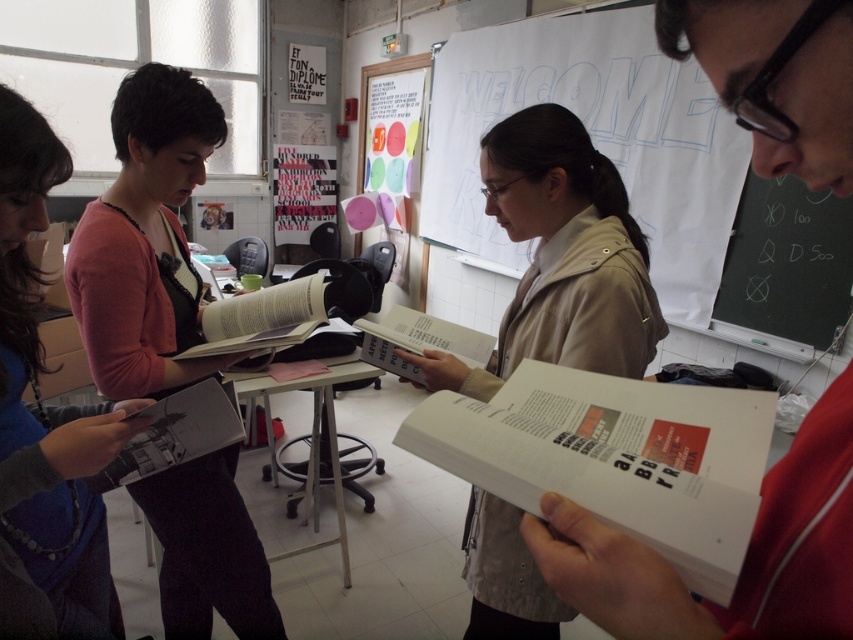
You are a participant in this collaborative activity and need to quickly reference a page in one of the books. Which object would be easier to flip through quickly, the white paper book at center or the beige fabric jacket at center?

The white paper book at center is thinner than the beige fabric jacket at center, so it would be easier to flip through quickly.

You are an attendee at this event and you want to see both the white paper at upper center and the beige fabric jacket at center. Which object do you need to move closer to first?

The beige fabric jacket at center is behind the white paper at upper center, so you need to move closer to the white paper at upper center first to see both objects.

You are standing in the classroom and need to reach the point labeled as point (x=107, y=358). There is an obstacle at point (x=608, y=125). Will you be able to walk directly to your destination without going around the obstacle?

Point (x=608, y=125) is behind point (x=107, y=358), so the obstacle at point (x=608, y=125) is not blocking your path to point (x=107, y=358). You can walk directly to your destination without going around.